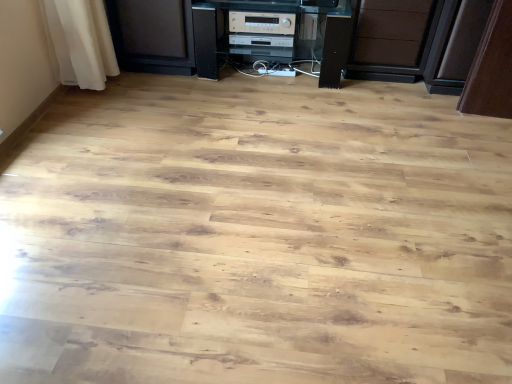
Identify the location of free space on the front side of black plastic stereo at center. The image size is (512, 384). (270, 120).